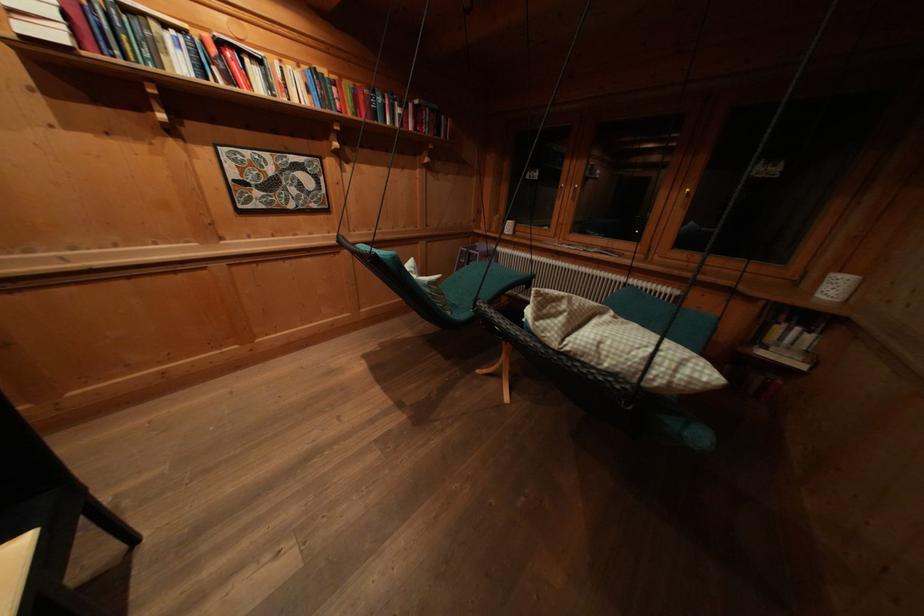
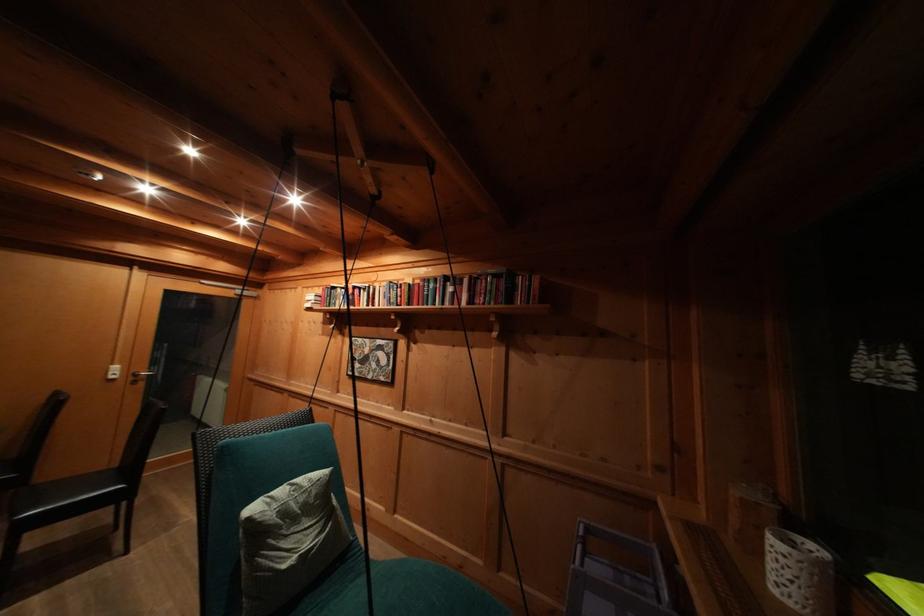
The point at (385, 103) is marked in the first image. Where is the corresponding point in the second image?

(438, 291)